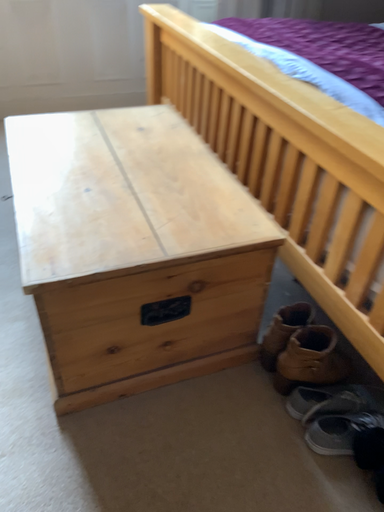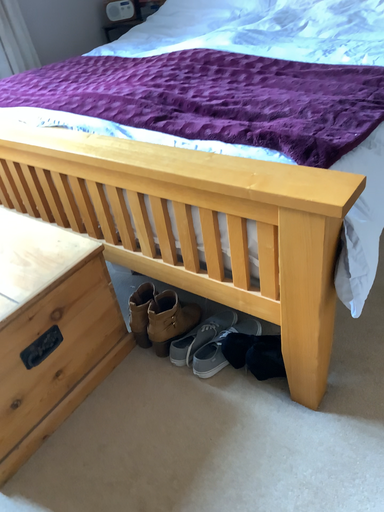
Question: How did the camera likely rotate when shooting the video?

Choices:
 (A) rotated left
 (B) rotated right

Answer: (B)